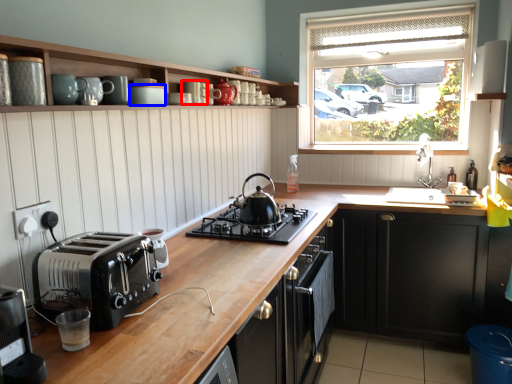
Question: Which point is further to the camera, appliance (highlighted by a red box) or appliance (highlighted by a blue box)?

Choices:
 (A) appliance
 (B) appliance

Answer: (A)